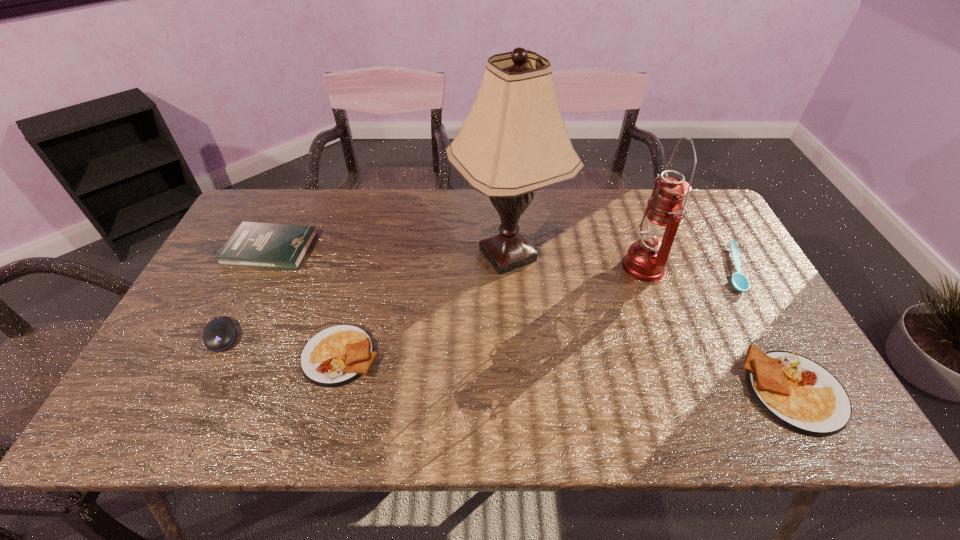
You are a GUI agent. You are given a task and a screenshot of the screen. Output one action in this format:
    pyautogui.click(x=<x>, y=<y>)
    Task: Click on the free space located 0.140m on the left of the left omelet
    The width and height of the screenshot is (960, 540).
    Given the screenshot: What is the action you would take?
    pyautogui.click(x=244, y=355)

Locate an element on the screen. free space located 0.160m on the back of the taller omelet is located at coordinates (745, 301).

At what (x,y) coordinates should I click in order to perform the action: click on vacant space situated 0.210m on the front of the tallest object. Please return your answer as a coordinate pair (x, y). Looking at the image, I should click on (515, 361).

The image size is (960, 540). Find the location of `free space located 0.120m on the front of the book`. free space located 0.120m on the front of the book is located at coordinates (245, 302).

This screenshot has height=540, width=960. Find the location of `vacant space situated on the front of the spoon`. vacant space situated on the front of the spoon is located at coordinates click(767, 328).

Image resolution: width=960 pixels, height=540 pixels. Find the location of `vacant space located on the front of the fifth object from left to right`. vacant space located on the front of the fifth object from left to right is located at coordinates (662, 317).

This screenshot has height=540, width=960. What are the coordinates of `blank space located 0.140m on the right of the computer mouse` in the screenshot? It's located at (296, 336).

This screenshot has height=540, width=960. Find the location of `lamp present at the far edge`. lamp present at the far edge is located at coordinates (513, 142).

Find the location of a particular element. book present at the far edge is located at coordinates (262, 245).

Image resolution: width=960 pixels, height=540 pixels. Identify the location of book present at the left edge. (262, 245).